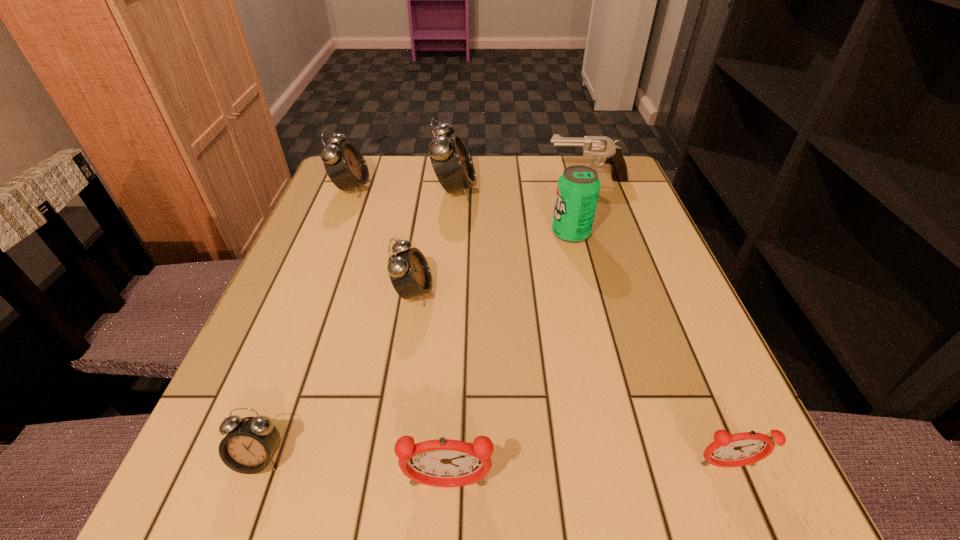
Where is `the biggest white alarm clock`? the biggest white alarm clock is located at coordinates [x=453, y=166].

Find the location of a particular element. The height and width of the screenshot is (540, 960). the tallest alarm clock is located at coordinates (453, 166).

Locate an element on the screen. The width and height of the screenshot is (960, 540). the second tallest alarm clock is located at coordinates (345, 165).

This screenshot has height=540, width=960. Find the location of `the fourth farthest object`. the fourth farthest object is located at coordinates [x=578, y=187].

The width and height of the screenshot is (960, 540). Find the location of `gun`. gun is located at coordinates (601, 146).

Where is `the fifth farthest object`? the fifth farthest object is located at coordinates (409, 272).

The width and height of the screenshot is (960, 540). What are the coordinates of `the second smallest white alarm clock` in the screenshot? It's located at (409, 272).

Locate an element on the screen. the bigger reddish-pink alarm clock is located at coordinates (446, 463).

What are the coordinates of `the left reddish-pink alarm clock` in the screenshot? It's located at (446, 463).

Locate an element on the screen. the farther reddish-pink alarm clock is located at coordinates (740, 449).